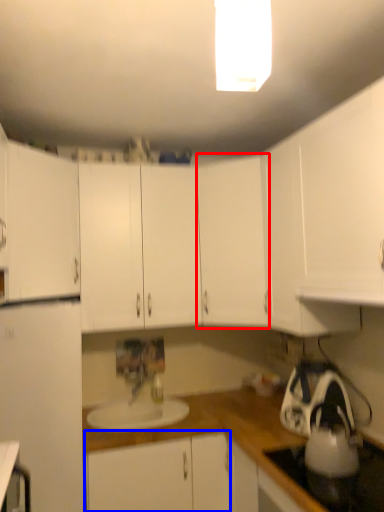
Question: Which point is closer to the camera, cabinetry (highlighted by a red box) or cabinetry (highlighted by a blue box)?

Choices:
 (A) cabinetry
 (B) cabinetry

Answer: (B)